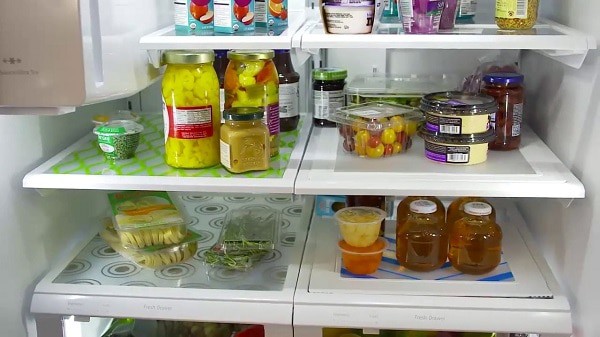
This screenshot has width=600, height=337. Find the location of `right side of fridge`. right side of fridge is located at coordinates (568, 249), (576, 115), (585, 15).